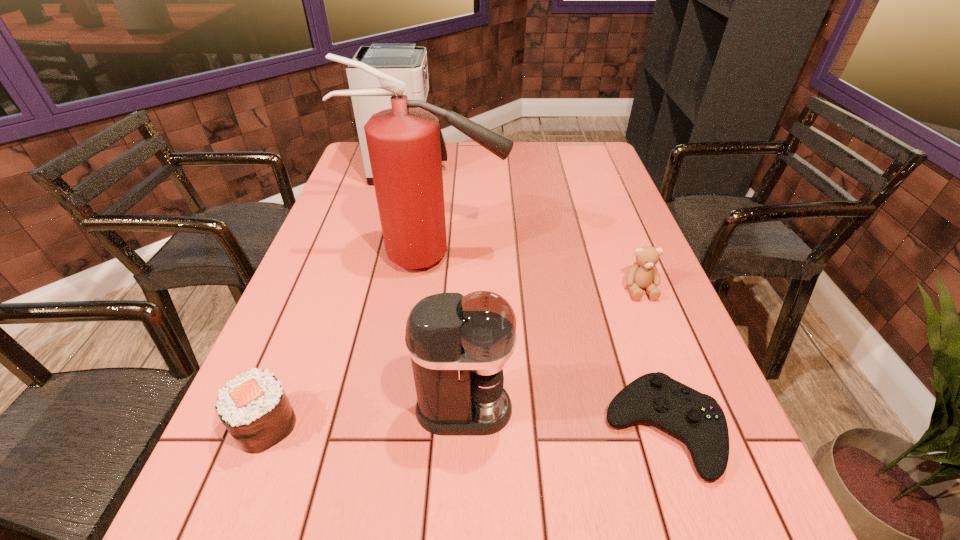
This screenshot has height=540, width=960. What are the coordinates of `vacant space located on the front panel of the taller coffee maker` in the screenshot? It's located at (519, 171).

Where is `vacant position located place cup under the spout of the nearer coffee maker`? vacant position located place cup under the spout of the nearer coffee maker is located at coordinates (714, 408).

I want to click on vacant space located 0.180m on the front-facing side of the teddy bear, so click(669, 362).

Find the location of a particular element. The width and height of the screenshot is (960, 540). free location located 0.340m on the back of the sushi is located at coordinates (323, 281).

Locate an element on the screen. free space located on the front of the control is located at coordinates (694, 524).

At what (x,y) coordinates should I click in order to perform the action: click on object at the far edge. Please return your answer as a coordinate pair (x, y). The width and height of the screenshot is (960, 540). Looking at the image, I should click on (406, 61).

You are a GUI agent. You are given a task and a screenshot of the screen. Output one action in this format:
    pyautogui.click(x=<x>, y=<y>)
    Task: Click on the fire extinguisher that is at the left edge
    This screenshot has width=960, height=540.
    Given the screenshot: What is the action you would take?
    pyautogui.click(x=403, y=142)

At what (x,y) coordinates should I click in order to perform the action: click on coffee maker present at the left edge. Please return your answer as a coordinate pair (x, y). Looking at the image, I should click on (406, 61).

The width and height of the screenshot is (960, 540). In order to click on sushi situated at the left edge in this screenshot , I will do `click(254, 408)`.

Image resolution: width=960 pixels, height=540 pixels. Find the location of `teddy bear located at the right edge`. teddy bear located at the right edge is located at coordinates (643, 274).